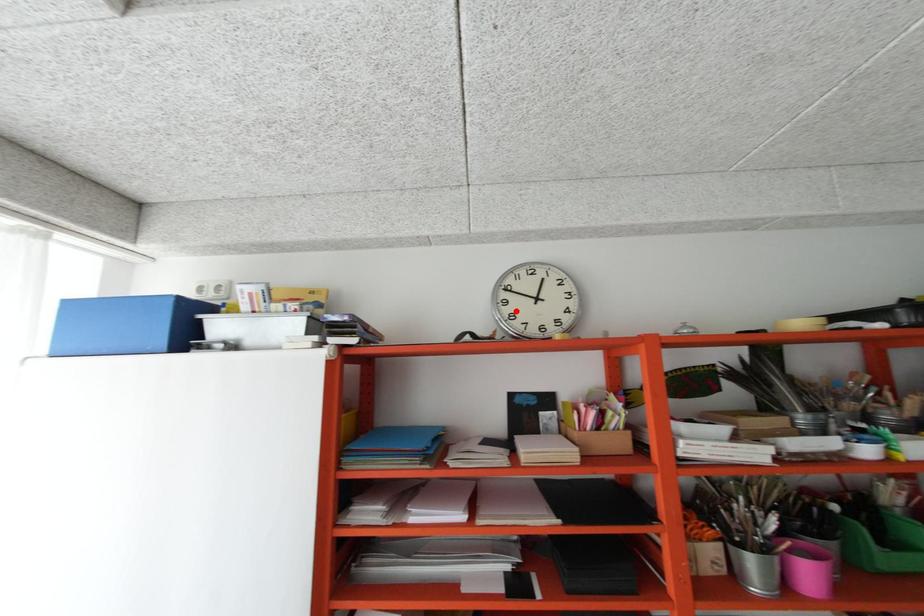
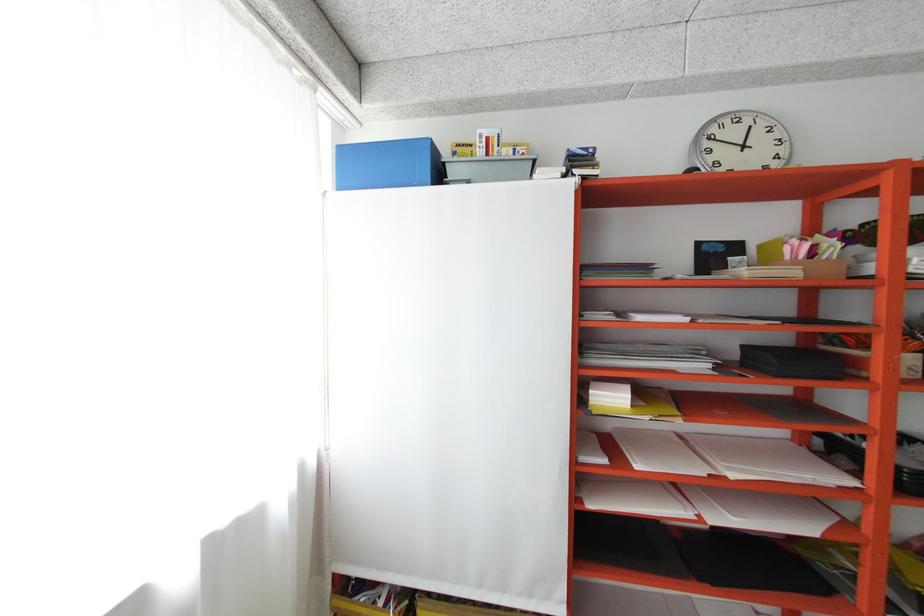
Where in the second image is the point corresponding to the highlighted location from the first image?

(720, 159)